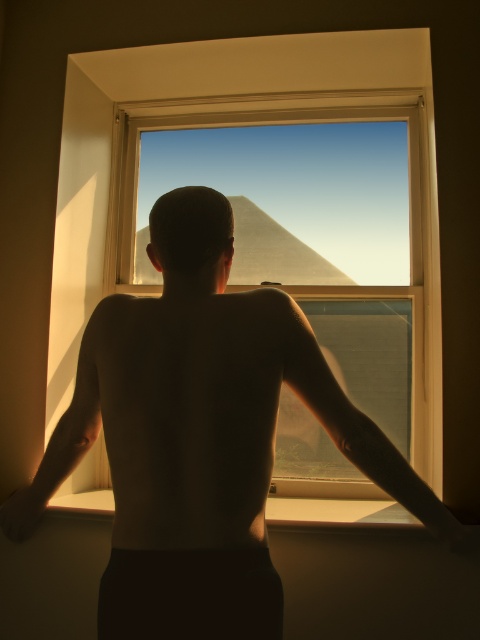
Does smooth skin at center have a lesser height compared to smooth skin arm at left?

Yes.

Is point (133, 355) behind point (25, 488)?

No, it is not.

Find the location of a particular element. smooth skin at center is located at coordinates (189, 412).

Is the position of skinny bald man at center less distant than that of clear glass window at center?

Yes, skinny bald man at center is closer to the viewer.

From the picture: Who is more forward, [214,291] or [365,362]?

Point [214,291] is in front.

Is point (41, 509) less distant than point (414, 372)?

Yes, it is.

Locate an element on the screen. Image resolution: width=480 pixels, height=640 pixels. skinny bald man at center is located at coordinates [201, 436].

Which of these two, clear glass window at center or satin skin arm at center, stands shorter?

satin skin arm at center

Does point (252, 172) come closer to viewer compared to point (338, 428)?

No, it is behind (338, 428).

Locate an element on the screen. The image size is (480, 640). clear glass window at center is located at coordinates (300, 227).